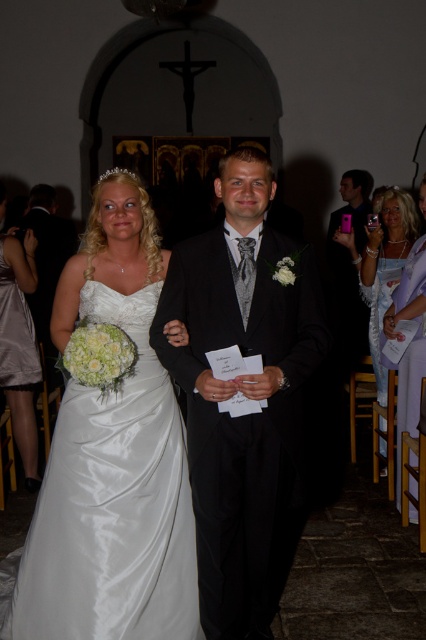
You are a photographer at the wedding and want to capture a closeup of the bride and groom walking down the aisle. You notice a purple dress at lower right located at point (408,344). Will this dress be in the frame if you position your camera to focus on the bride and groom?

The purple dress at lower right is located at point (408,344), which is outside the main focus area of the bride and groom walking down the aisle. Therefore, it will not be in the frame if the camera is positioned to focus on them.

Consider the image. You are a photographer positioned at the back of the church. You want to capture a photo of both the satin dress at center and the white satin dress at right without any obstruction. Given their heights, which dress might block the view of the other?

The satin dress at center is much taller than the white satin dress at right, so it might block the view of the white satin dress at right.